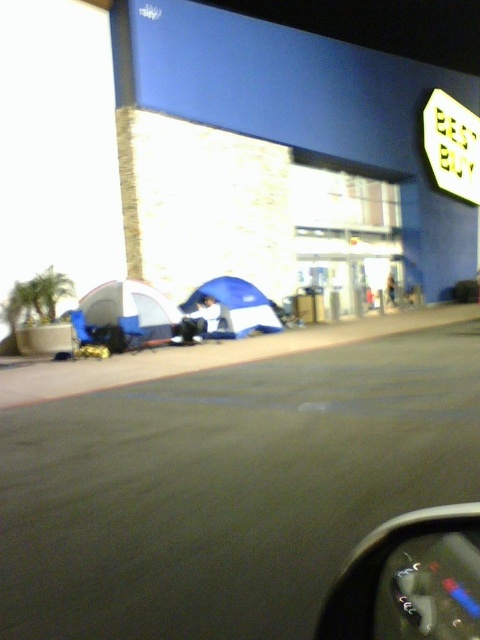
You are standing in front of the Best Buy store at night and see the blue fabric tent at lower left and the blue fabric tent at center. Which tent is located to the left of the other?

The blue fabric tent at lower left is positioned on the left side of the blue fabric tent at center.